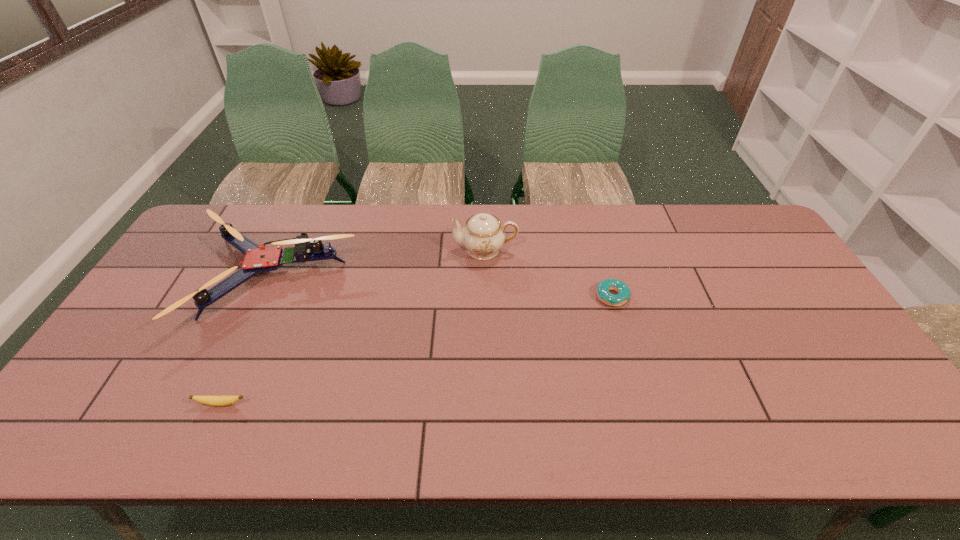
This screenshot has height=540, width=960. What are the coordinates of `vacant space in between the third shortest object and the rightmost object` in the screenshot? It's located at (442, 287).

At what (x,y) coordinates should I click in order to perform the action: click on vacant space that is in between the rightmost object and the drone. Please return your answer as a coordinate pair (x, y). The width and height of the screenshot is (960, 540). Looking at the image, I should click on (442, 287).

Image resolution: width=960 pixels, height=540 pixels. Find the location of `unoccupied area between the third shortest object and the chinaware`. unoccupied area between the third shortest object and the chinaware is located at coordinates (378, 264).

You are a GUI agent. You are given a task and a screenshot of the screen. Output one action in this format:
    pyautogui.click(x=<x>, y=<y>)
    Task: Click on the vacant area between the rightmost object and the third object from left to right
    
    Given the screenshot: What is the action you would take?
    pyautogui.click(x=548, y=273)

The image size is (960, 540). I want to click on free spot between the nearest object and the third object from left to right, so click(353, 327).

Find the location of a particular element. This screenshot has height=540, width=960. free space that is in between the third shortest object and the nearest object is located at coordinates (246, 341).

At what (x,y) coordinates should I click in order to perform the action: click on unoccupied area between the third shortest object and the banana. Please return your answer as a coordinate pair (x, y). Looking at the image, I should click on (246, 341).

Where is `empty space that is in between the tallest object and the drone`? The width and height of the screenshot is (960, 540). empty space that is in between the tallest object and the drone is located at coordinates (378, 264).

At what (x,y) coordinates should I click in order to perform the action: click on free area in between the nearest object and the doughnut. Please return your answer as a coordinate pair (x, y). Looking at the image, I should click on (417, 350).

At what (x,y) coordinates should I click in order to perform the action: click on vacant point located between the chinaware and the nearest object. Please return your answer as a coordinate pair (x, y). Looking at the image, I should click on (353, 327).